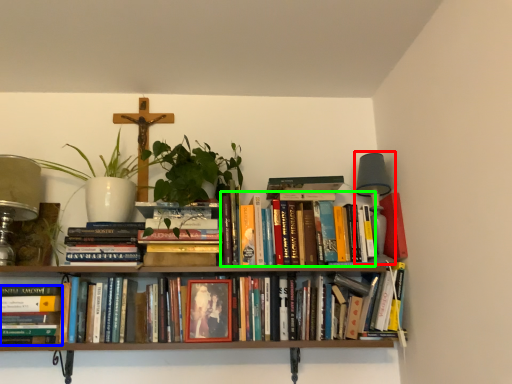
Question: Estimate the real-world distances between objects in this image. Which object is closer to table lamp (highlighted by a red box), book (highlighted by a blue box) or book (highlighted by a green box)?

Choices:
 (A) book
 (B) book

Answer: (B)